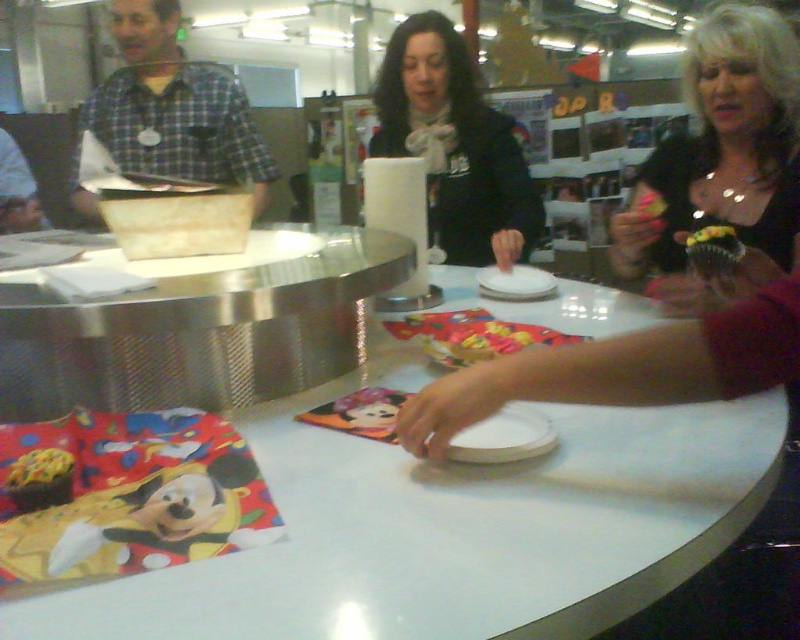
Question: Which point appears farthest from the camera in this image?

Choices:
 (A) (720, 241)
 (B) (266, 582)
 (C) (794, 211)
 (D) (52, 458)

Answer: (C)

Question: Can you confirm if white glossy table at center is positioned below black matte scarf at center?

Choices:
 (A) no
 (B) yes

Answer: (B)

Question: Which object appears closest to the camera in this image?

Choices:
 (A) shiny black dress at center
 (B) green frosted cupcake at center right
 (C) white glossy table at center

Answer: (C)

Question: Does black matte scarf at center lie behind chocolate frosted cupcake at center?

Choices:
 (A) yes
 (B) no

Answer: (A)

Question: Is chocolate frosted cupcake at center to the left of green frosted cupcake at center right from the viewer's perspective?

Choices:
 (A) no
 (B) yes

Answer: (B)

Question: Which object appears closest to the camera in this image?

Choices:
 (A) black matte scarf at center
 (B) green frosted cupcake at center right

Answer: (B)